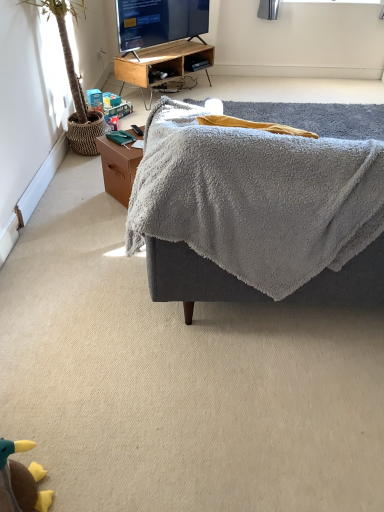
This screenshot has width=384, height=512. What are the coordinates of `vacant area situated to the left side of gray fuzzy ottoman at center` in the screenshot? It's located at (74, 305).